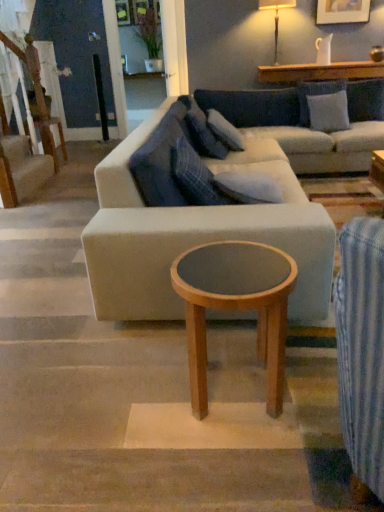
Image resolution: width=384 pixels, height=512 pixels. In order to click on free point above light brown wood coffee table at center (from a real-world perspective) in this screenshot , I will do `click(232, 267)`.